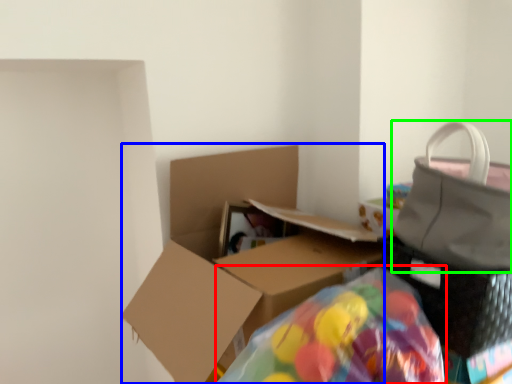
Question: Which is nearer to the bean bag chair (highlighted by a red box)? box (highlighted by a blue box) or handbag (highlighted by a green box).

Choices:
 (A) box
 (B) handbag

Answer: (B)